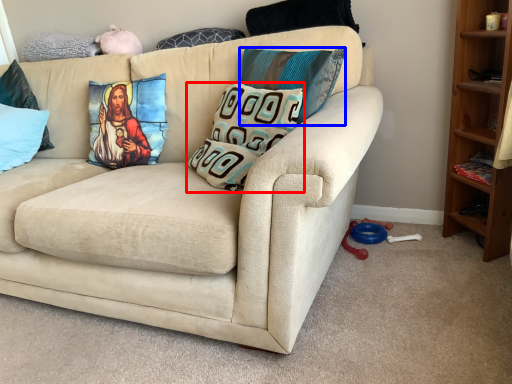
Question: Which object appears farthest to the camera in this image, pillow (highlighted by a red box) or pillow (highlighted by a blue box)?

Choices:
 (A) pillow
 (B) pillow

Answer: (B)